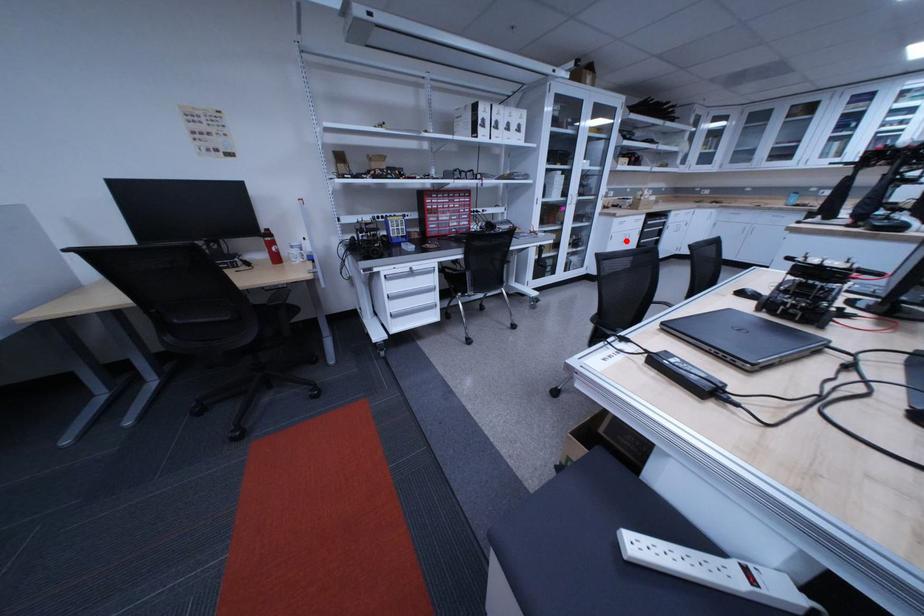
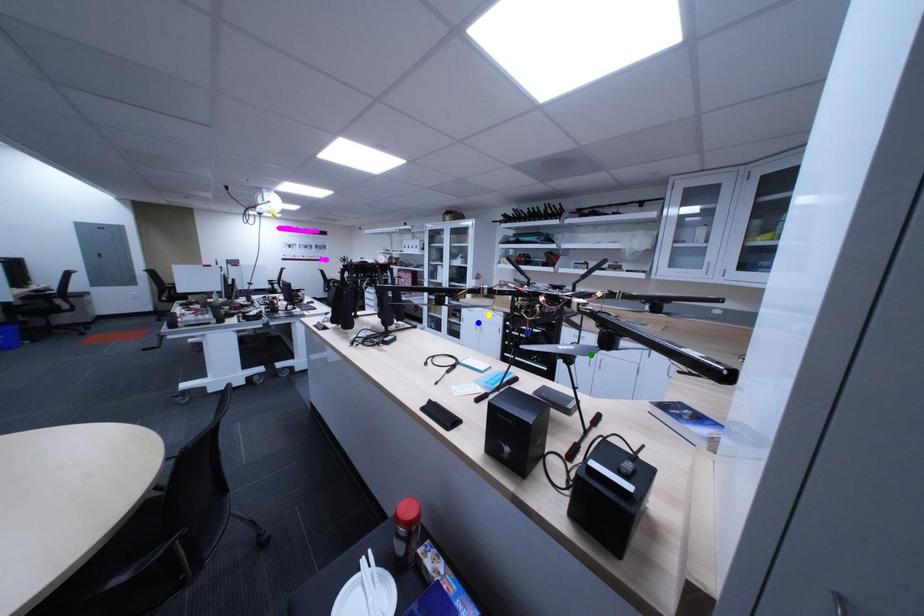
Question: I am providing you with two images of the same scene from different viewpoints. A red point is marked on the first image. You are given multiple points on the second image. Which spot in image 2 lines up with the point in image 1?

Choices:
 (A) blue point
 (B) yellow point
 (C) green point

Answer: (A)